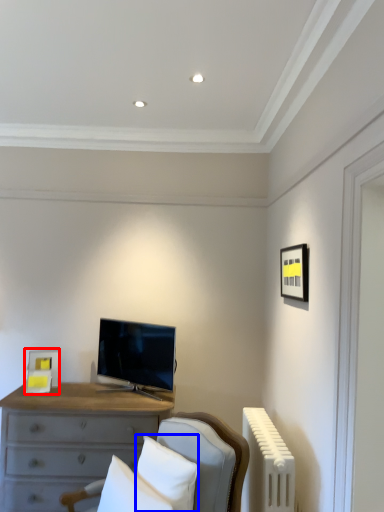
Question: Among these objects, which one is nearest to the camera, picture frame (highlighted by a red box) or pillow (highlighted by a blue box)?

Choices:
 (A) picture frame
 (B) pillow

Answer: (B)